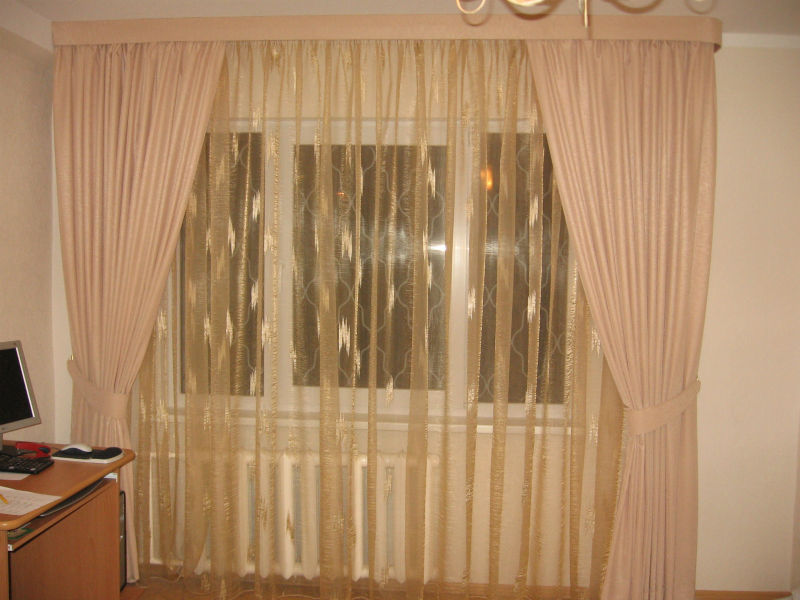
Locate an element on the screen. sheer gold color curtains is located at coordinates (504, 300), (410, 374), (326, 302), (209, 384), (189, 392).